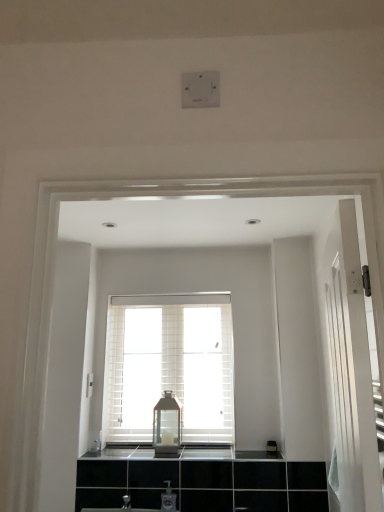
Question: Is matte glass lantern at center positioned with its back to white textured window at center?

Choices:
 (A) yes
 (B) no

Answer: (A)

Question: From a real-world perspective, is matte glass lantern at center physically above white textured window at center?

Choices:
 (A) yes
 (B) no

Answer: (B)

Question: Is matte glass lantern at center aimed at white textured window at center?

Choices:
 (A) yes
 (B) no

Answer: (B)

Question: Considering the relative sizes of matte glass lantern at center and white textured window at center in the image provided, is matte glass lantern at center taller than white textured window at center?

Choices:
 (A) yes
 (B) no

Answer: (B)

Question: Would you consider matte glass lantern at center to be distant from white textured window at center?

Choices:
 (A) no
 (B) yes

Answer: (A)

Question: Considering the positions of point (173, 407) and point (203, 451), is point (173, 407) closer or farther from the camera than point (203, 451)?

Choices:
 (A) farther
 (B) closer

Answer: (A)

Question: From the image's perspective, relative to black glossy countertop at center, is matte glass lantern at center above or below?

Choices:
 (A) below
 (B) above

Answer: (B)

Question: Considering the positions of matte glass lantern at center and black glossy countertop at center in the image, is matte glass lantern at center taller or shorter than black glossy countertop at center?

Choices:
 (A) tall
 (B) short

Answer: (A)

Question: Visually, is matte glass lantern at center positioned to the left or to the right of black glossy countertop at center?

Choices:
 (A) right
 (B) left

Answer: (B)

Question: From a real-world perspective, is matte glass lantern at center physically located above or below white textured window at center?

Choices:
 (A) below
 (B) above

Answer: (A)

Question: From the image's perspective, is matte glass lantern at center above or below white textured window at center?

Choices:
 (A) below
 (B) above

Answer: (A)

Question: Considering the positions of matte glass lantern at center and white textured window at center in the image, is matte glass lantern at center bigger or smaller than white textured window at center?

Choices:
 (A) small
 (B) big

Answer: (A)

Question: Considering the positions of matte glass lantern at center and white textured window at center in the image, is matte glass lantern at center taller or shorter than white textured window at center?

Choices:
 (A) tall
 (B) short

Answer: (B)

Question: Which is correct: matte glass lantern at center is inside clear plastic soap dispenser at lower center, or outside of it?

Choices:
 (A) outside
 (B) inside

Answer: (A)

Question: Is point (168, 415) closer or farther from the camera than point (167, 504)?

Choices:
 (A) farther
 (B) closer

Answer: (A)